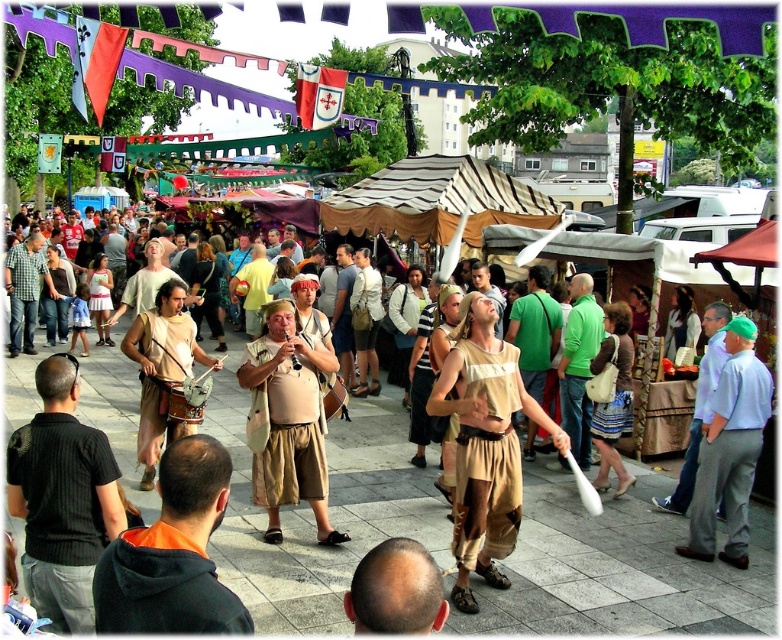
You are a festival attendee who wants to reach the light brown leather bag at center without getting too close to the orange hoodie at lower left. Given that you can only move in a straight line from your current position, can you safely do so?

The orange hoodie at lower left and light brown leather bag at center are 15.24 feet apart, so yes, you can move in a straight line to the light brown leather bag at center while maintaining a safe distance from the orange hoodie at lower left since they are 15.24 feet apart.

You are a festival attendee looking for your misplaced backpack. You remember seeing an orange hoodie at lower left and a light brown leather bag at center. Which object is smaller in size?

The orange hoodie at lower left is smaller than the light brown leather bag at center.